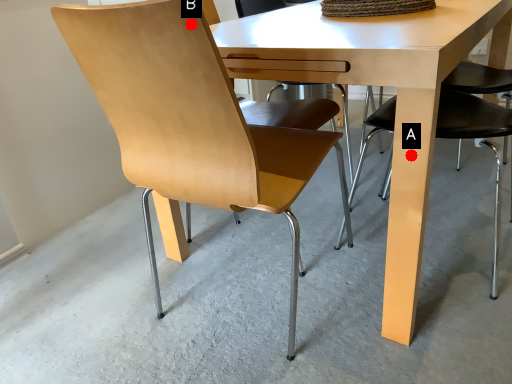
Question: Two points are circled on the image, labeled by A and B beside each circle. Which point is further to the camera?

Choices:
 (A) A is further
 (B) B is further

Answer: (A)